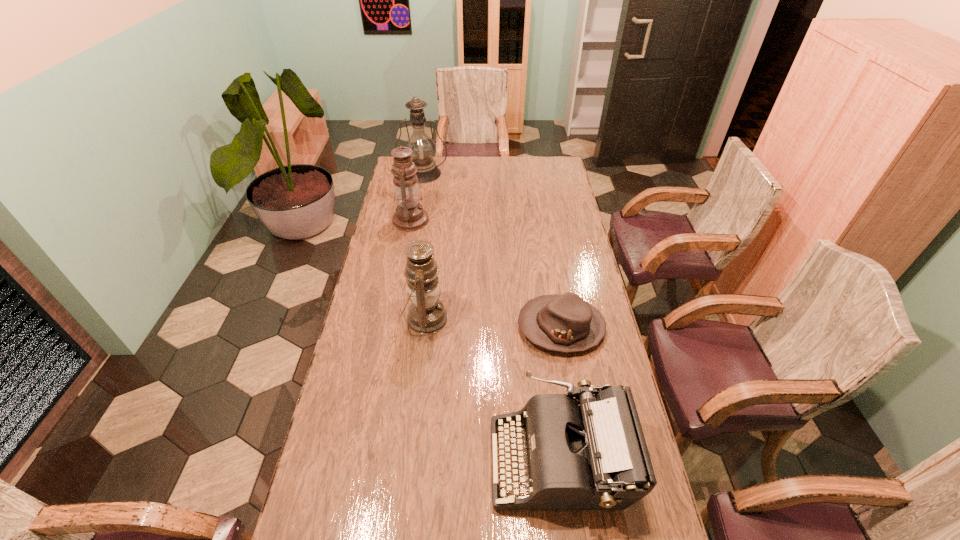
This screenshot has height=540, width=960. Identify the location of free point between the second farthest object and the typewriter. (485, 340).

You are a GUI agent. You are given a task and a screenshot of the screen. Output one action in this format:
    pyautogui.click(x=<x>, y=<y>)
    Task: Click on the object that is the third closest one to the fourth nearest object
    
    Given the screenshot: What is the action you would take?
    coord(566,323)

Where is `object that stands as the fourth closest to the nearest object`? The height and width of the screenshot is (540, 960). object that stands as the fourth closest to the nearest object is located at coordinates (424, 149).

The height and width of the screenshot is (540, 960). Find the location of `the second closest oil lamp to the nearest oil lamp`. the second closest oil lamp to the nearest oil lamp is located at coordinates (424, 149).

Select which oil lamp is the second closest to the nearest oil lamp. Please provide its 2D coordinates. Your answer should be formatted as a tuple, i.e. [(x, y)], where the tuple contains the x and y coordinates of a point satisfying the conditions above.

[(424, 149)]

The height and width of the screenshot is (540, 960). Find the location of `vacant space that satisfies the following two spatial constraints: 1. on the front side of the nearest oil lamp; 2. on the right side of the second farthest oil lamp`. vacant space that satisfies the following two spatial constraints: 1. on the front side of the nearest oil lamp; 2. on the right side of the second farthest oil lamp is located at coordinates (393, 319).